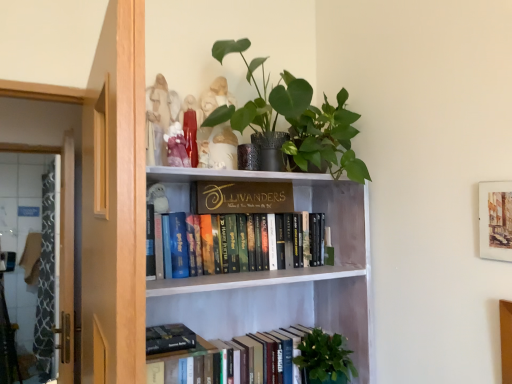
The image size is (512, 384). In order to click on free space above hardcover books at center, the first book from the top (from a real-world perspective) in this screenshot , I will do `click(225, 204)`.